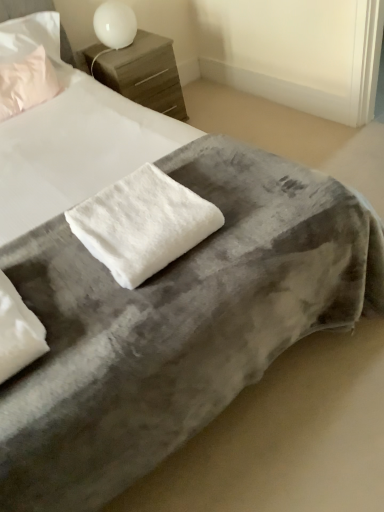
Identify the location of free space to the left of white fluffy towel at center. The height and width of the screenshot is (512, 384). (52, 263).